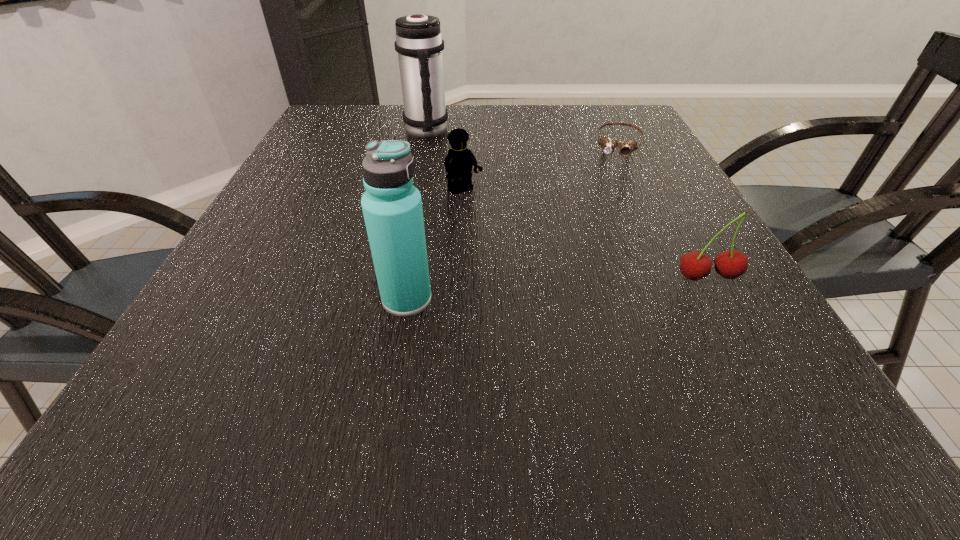
Where is `free location located 0.400m on the side with the handle of the farther thermos bottle`? The height and width of the screenshot is (540, 960). free location located 0.400m on the side with the handle of the farther thermos bottle is located at coordinates (500, 228).

The image size is (960, 540). In order to click on free space located on the front lenses and sides of the shortest object in this screenshot , I will do `click(602, 251)`.

Locate an element on the screen. The image size is (960, 540). vacant point located on the front lenses and sides of the shortest object is located at coordinates (612, 198).

Find the location of a particular element. Image resolution: width=960 pixels, height=540 pixels. free space located 0.380m on the front lenses and sides of the shortest object is located at coordinates (601, 254).

Find the location of a particular element. This screenshot has width=960, height=540. free space located 0.120m on the front-facing side of the Lego is located at coordinates (500, 229).

Find the location of a particular element. vacant area situated 0.160m on the front-facing side of the Lego is located at coordinates (511, 240).

Where is `vacant region located on the front-facing side of the Lego`? This screenshot has width=960, height=540. vacant region located on the front-facing side of the Lego is located at coordinates (524, 255).

Identify the location of thermos bottle situated at the far edge. (419, 43).

Locate an element on the screen. The height and width of the screenshot is (540, 960). goggles located at the far edge is located at coordinates (607, 144).

What are the coordinates of `cherry at the right edge` in the screenshot? It's located at (730, 264).